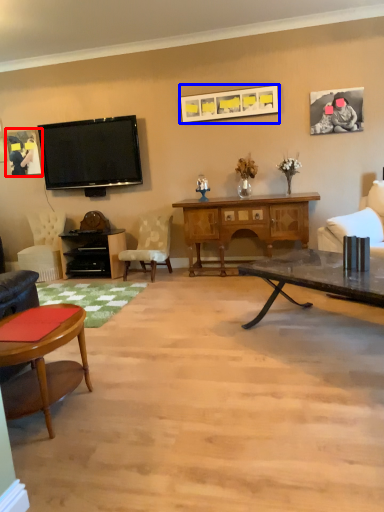
Question: Which of the following is the closest to the observer, picture frame (highlighted by a red box) or picture frame (highlighted by a blue box)?

Choices:
 (A) picture frame
 (B) picture frame

Answer: (B)